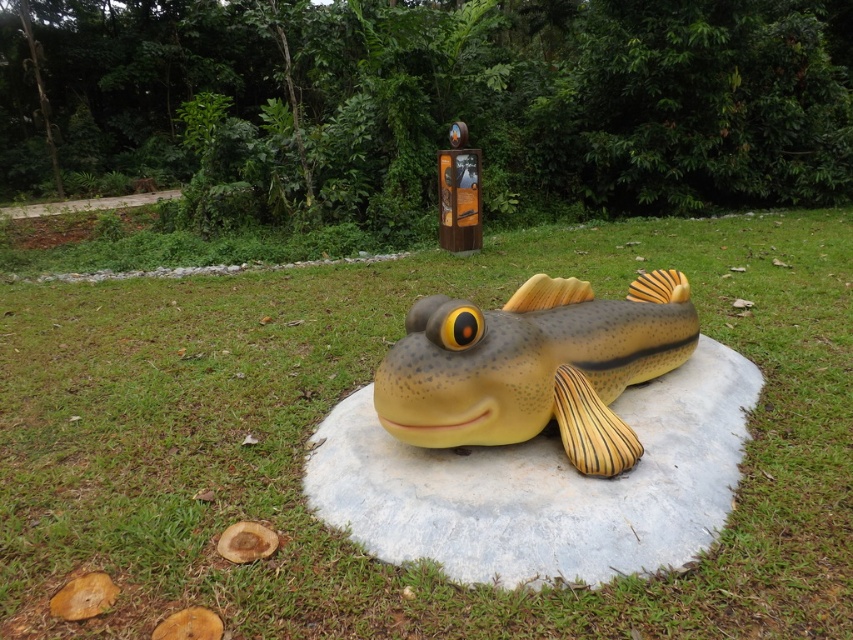
Question: Is green grass at center behind matte yellow fish at center?

Choices:
 (A) yes
 (B) no

Answer: (A)

Question: Which point appears closest to the camera in this image?

Choices:
 (A) (41, 544)
 (B) (541, 422)

Answer: (A)

Question: Among these points, which one is nearest to the camera?

Choices:
 (A) (450, 422)
 (B) (782, 541)

Answer: (B)

Question: Can you confirm if green grass at center is smaller than matte yellow fish at center?

Choices:
 (A) no
 (B) yes

Answer: (B)

Question: Among these objects, which one is nearest to the camera?

Choices:
 (A) matte yellow fish at center
 (B) green grass at center

Answer: (A)

Question: Does green grass at center have a lesser width compared to matte yellow fish at center?

Choices:
 (A) no
 (B) yes

Answer: (B)